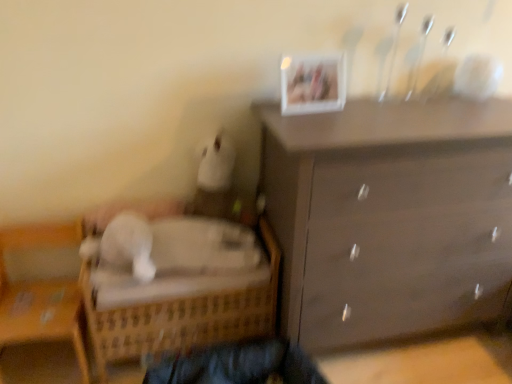
In order to face wooden wicker basket at lower left, should I rotate leftwards or rightwards?

Turn left by 27.355 degrees to look at wooden wicker basket at lower left.

Identify the location of white plastic picture frame at upper center. This screenshot has height=384, width=512. (313, 83).

What do you see at coordinates (313, 83) in the screenshot?
I see `white plastic picture frame at upper center` at bounding box center [313, 83].

This screenshot has height=384, width=512. Describe the element at coordinates (239, 365) in the screenshot. I see `dark blue fabric at lower center` at that location.

Where is `woven wood bed at lower left`? The image size is (512, 384). woven wood bed at lower left is located at coordinates (183, 310).

Between dark blue fabric at lower center and white plastic picture frame at upper center, which one has less height?

With less height is dark blue fabric at lower center.

Would you consider dark blue fabric at lower center to be distant from white plastic picture frame at upper center?

No, there isn't a large distance between dark blue fabric at lower center and white plastic picture frame at upper center.

Which is behind, point (277, 339) or point (338, 67)?

The point (277, 339) is more distant.

Considering the sizes of objects dark blue fabric at lower center and white plastic picture frame at upper center in the image provided, who is smaller, dark blue fabric at lower center or white plastic picture frame at upper center?

With smaller size is white plastic picture frame at upper center.

Where is `bed behind the wooden wicker basket at lower left`? The height and width of the screenshot is (384, 512). bed behind the wooden wicker basket at lower left is located at coordinates (183, 310).

Could you tell me if woven wood bed at lower left is turned towards wooden wicker basket at lower left?

No.

Can you tell me how much woven wood bed at lower left and wooden wicker basket at lower left differ in facing direction?

The angular difference between woven wood bed at lower left and wooden wicker basket at lower left is 2.45 degrees.

Can we say woven wood bed at lower left lies outside wooden wicker basket at lower left?

woven wood bed at lower left is positioned outside wooden wicker basket at lower left.

Between white plastic picture frame at upper center and woven wood bed at lower left, which one has smaller size?

With smaller size is white plastic picture frame at upper center.

Which is behind, point (340, 101) or point (272, 311)?

The point (272, 311) is more distant.

Considering the sizes of white plastic picture frame at upper center and woven wood bed at lower left in the image, is white plastic picture frame at upper center taller or shorter than woven wood bed at lower left?

In the image, white plastic picture frame at upper center appears to be shorter than woven wood bed at lower left.

This screenshot has height=384, width=512. I want to click on picture frame on the right of the woven wood bed at lower left, so click(x=313, y=83).

From the image's perspective, is dark blue fabric at lower center below matte brown dresser at upper right?

Yes.

Does point (300, 364) come in front of point (376, 131)?

No, it is behind (376, 131).

Is dark blue fabric at lower center facing away from matte brown dresser at upper right?

No.

In terms of height, does matte brown dresser at upper right look taller or shorter compared to woven wood bed at lower left?

matte brown dresser at upper right is taller than woven wood bed at lower left.

Is matte brown dresser at upper right completely or partially outside of woven wood bed at lower left?

Yes.

Could you tell me if matte brown dresser at upper right is turned towards woven wood bed at lower left?

No, matte brown dresser at upper right does not turn towards woven wood bed at lower left.

In the scene shown: Are matte brown dresser at upper right and woven wood bed at lower left located far from each other?

matte brown dresser at upper right is actually quite close to woven wood bed at lower left.

From the image's perspective, is woven wood bed at lower left beneath matte brown dresser at upper right?

Correct, woven wood bed at lower left appears lower than matte brown dresser at upper right in the image.

Can you confirm if woven wood bed at lower left is taller than matte brown dresser at upper right?

In fact, woven wood bed at lower left may be shorter than matte brown dresser at upper right.

Can you see woven wood bed at lower left touching matte brown dresser at upper right?

No, woven wood bed at lower left is not making contact with matte brown dresser at upper right.

Does point (291, 370) come in front of point (27, 331)?

That is False.

Does dark blue fabric at lower center have a greater height compared to wooden wicker basket at lower left?

Incorrect, the height of dark blue fabric at lower center is not larger of that of wooden wicker basket at lower left.

Is dark blue fabric at lower center to the left or to the right of wooden wicker basket at lower left in the image?

In the image, dark blue fabric at lower center appears on the right side of wooden wicker basket at lower left.

Identify the location of picture frame above the dark blue fabric at lower center (from a real-world perspective). The width and height of the screenshot is (512, 384). tap(313, 83).

Locate an element on the screen. The image size is (512, 384). bed beneath the wooden wicker basket at lower left (from a real-world perspective) is located at coordinates (183, 310).

Which object lies further to the anchor point matte brown dresser at upper right, wooden wicker basket at lower left or dark blue fabric at lower center?

wooden wicker basket at lower left.

Estimate the real-world distances between objects in this image. Which object is further from matte brown dresser at upper right, dark blue fabric at lower center or wooden wicker basket at lower left?

wooden wicker basket at lower left is further to matte brown dresser at upper right.

From the picture: When comparing their distances from wooden wicker basket at lower left, does matte brown dresser at upper right or dark blue fabric at lower center seem closer?

dark blue fabric at lower center is closer to wooden wicker basket at lower left.

Considering their positions, is white plastic picture frame at upper center positioned closer to wooden wicker basket at lower left than woven wood bed at lower left?

woven wood bed at lower left is closer to wooden wicker basket at lower left.

Estimate the real-world distances between objects in this image. Which object is further from white plastic picture frame at upper center, dark blue fabric at lower center or wooden wicker basket at lower left?

Among the two, wooden wicker basket at lower left is located further to white plastic picture frame at upper center.

Which object lies nearer to the anchor point matte brown dresser at upper right, woven wood bed at lower left or white plastic picture frame at upper center?

woven wood bed at lower left lies closer to matte brown dresser at upper right than the other object.

Based on their spatial positions, is matte brown dresser at upper right or white plastic picture frame at upper center closer to woven wood bed at lower left?

matte brown dresser at upper right is positioned closer to the anchor woven wood bed at lower left.

Considering their positions, is dark blue fabric at lower center positioned closer to matte brown dresser at upper right than white plastic picture frame at upper center?

white plastic picture frame at upper center lies closer to matte brown dresser at upper right than the other object.

Locate an element on the screen. This screenshot has width=512, height=384. picture frame between woven wood bed at lower left and matte brown dresser at upper right from left to right is located at coordinates (313, 83).

Find the location of a particular element. The width and height of the screenshot is (512, 384). bed between white plastic picture frame at upper center and dark blue fabric at lower center in the vertical direction is located at coordinates (183, 310).

In order to click on clothing located between woven wood bed at lower left and matte brown dresser at upper right in the left-right direction in this screenshot , I will do `click(239, 365)`.

In order to click on furniture between white plastic picture frame at upper center and dark blue fabric at lower center vertically in this screenshot , I will do `click(42, 306)`.